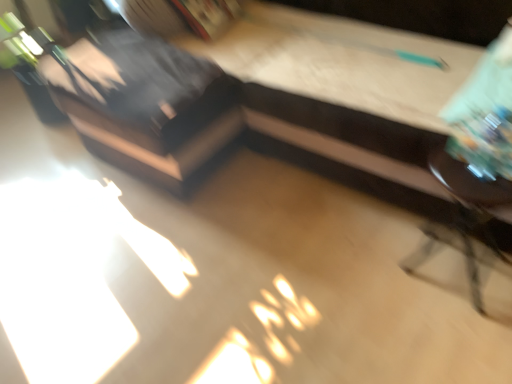
Image resolution: width=512 pixels, height=384 pixels. What are the coordinates of `metallic dark brown swivel chair at right` in the screenshot? It's located at (463, 218).

What do you see at coordinates (463, 218) in the screenshot? I see `metallic dark brown swivel chair at right` at bounding box center [463, 218].

Where is `metallic dark brown swivel chair at right`? The width and height of the screenshot is (512, 384). metallic dark brown swivel chair at right is located at coordinates (463, 218).